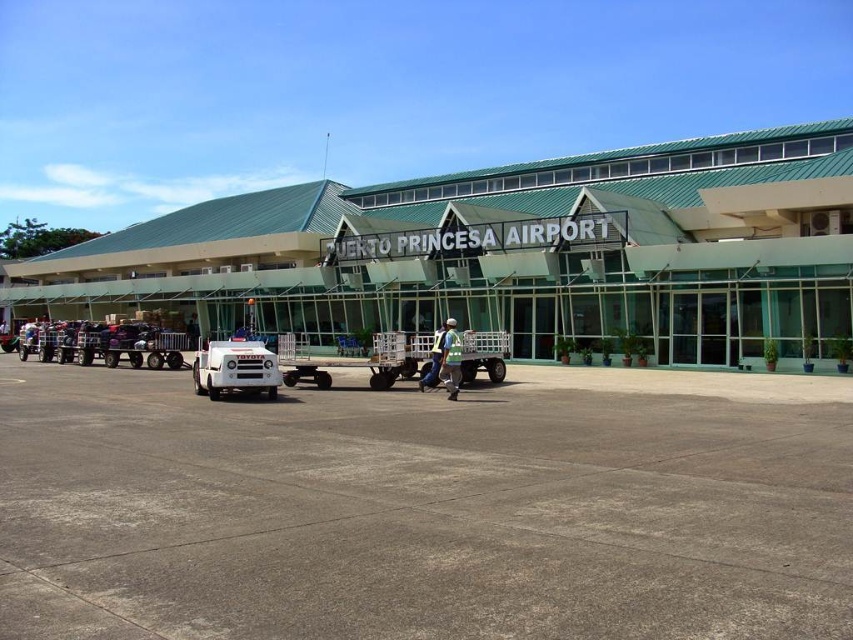
Question: Does gray concrete tarmac at center lie in front of light blue uniform at center?

Choices:
 (A) yes
 (B) no

Answer: (A)

Question: Which object appears closest to the camera in this image?

Choices:
 (A) white hard hat at center
 (B) white plastic cart at center

Answer: (A)

Question: Which point is closer to the camera taking this photo?

Choices:
 (A) (125, 284)
 (B) (445, 326)

Answer: (B)

Question: Estimate the real-world distances between objects in this image. Which object is farther from the white plastic cart at center?

Choices:
 (A) green glass building at center
 (B) white hard hat at center
 (C) light blue uniform at center
 (D) gray concrete tarmac at center

Answer: (A)

Question: Is green glass building at center to the left of white hard hat at center from the viewer's perspective?

Choices:
 (A) yes
 (B) no

Answer: (A)

Question: Does gray concrete tarmac at center appear on the left side of white hard hat at center?

Choices:
 (A) no
 (B) yes

Answer: (B)